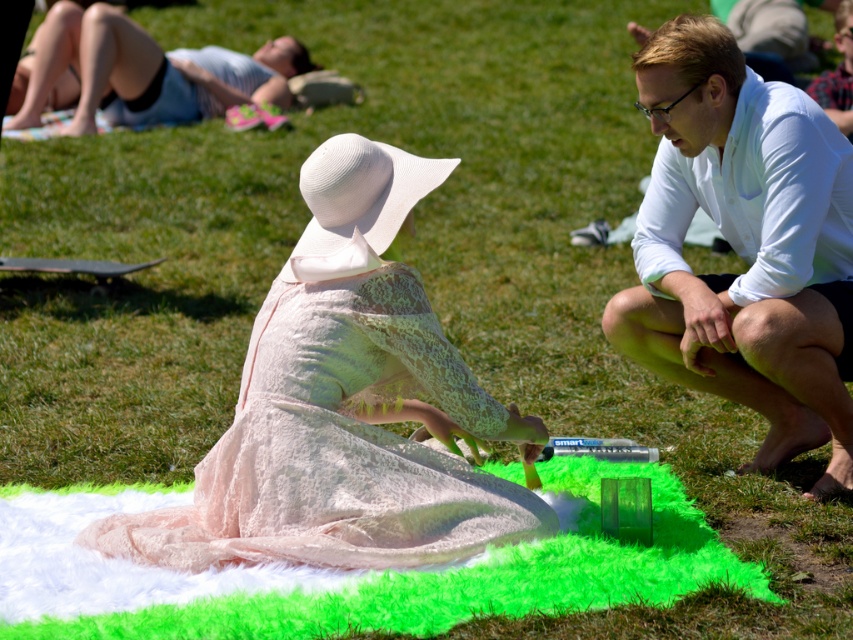
Does light pink lace dress at center appear on the right side of white cotton shirt at right?

Incorrect, light pink lace dress at center is not on the right side of white cotton shirt at right.

Based on the photo, which is above, light pink lace dress at center or white cotton shirt at right?

white cotton shirt at right is higher up.

Between point (349, 532) and point (720, 97), which one is positioned in front?

Positioned in front is point (349, 532).

Image resolution: width=853 pixels, height=640 pixels. Identify the location of light pink lace dress at center. (345, 404).

Who is more distant from viewer, (x=252, y=456) or (x=209, y=106)?

The point (x=209, y=106) is more distant.

Is light pink lace dress at center positioned at the back of light blue denim shorts at upper left?

No, it is in front of light blue denim shorts at upper left.

Image resolution: width=853 pixels, height=640 pixels. Describe the element at coordinates (345, 404) in the screenshot. I see `light pink lace dress at center` at that location.

Identify the location of light pink lace dress at center. (345, 404).

Is white cotton shirt at right wider than light blue denim shorts at upper left?

No.

Does white cotton shirt at right appear under light blue denim shorts at upper left?

Correct, white cotton shirt at right is located below light blue denim shorts at upper left.

Describe the element at coordinates (744, 246) in the screenshot. I see `white cotton shirt at right` at that location.

Locate an element on the screen. This screenshot has height=640, width=853. white cotton shirt at right is located at coordinates (744, 246).